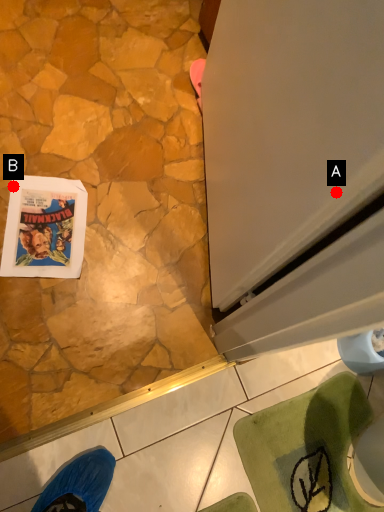
Question: Two points are circled on the image, labeled by A and B beside each circle. Which point is closer to the camera?

Choices:
 (A) A is closer
 (B) B is closer

Answer: (A)